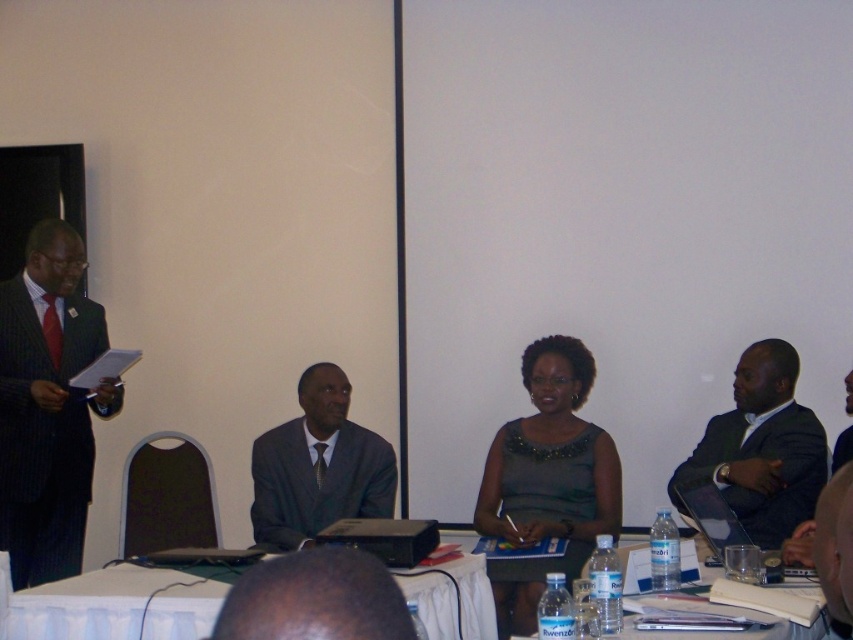
Looking at this image, what are the coordinates of the green satin dress at center?

The green satin dress at center is located at coordinates point [547,481].

You are organizing a photo shoot and need to ensure that the dark gray suit at right and the dark gray suit at center are visible in the frame. Given that your camera has a limited focus range, which dark gray suit should you prioritize to keep in focus if you can only focus on one?

The dark gray suit at right is bigger than the dark gray suit at center, so you should prioritize keeping the dark gray suit at right in focus as it is larger and more prominent in the frame.